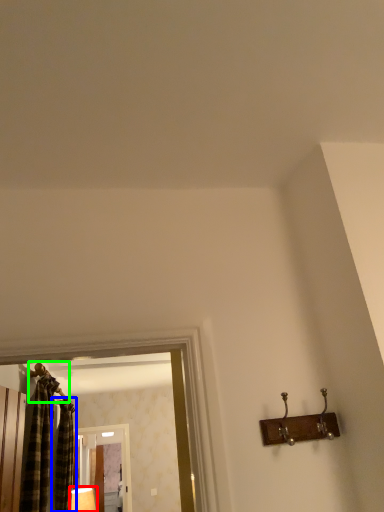
Question: Which is farther away from lamp (highlighted by a red box)? shower curtain (highlighted by a blue box) or hanger (highlighted by a green box)?

Choices:
 (A) shower curtain
 (B) hanger

Answer: (B)